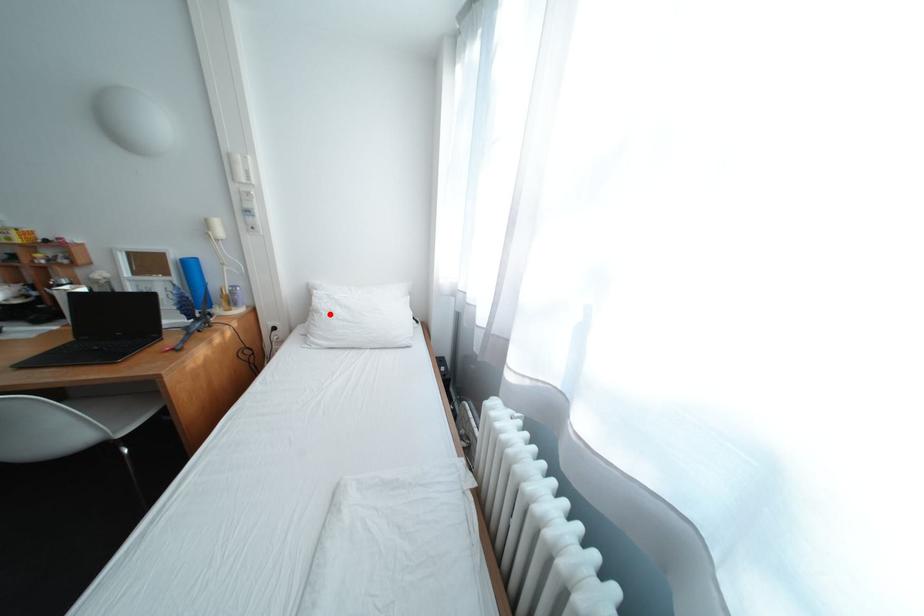
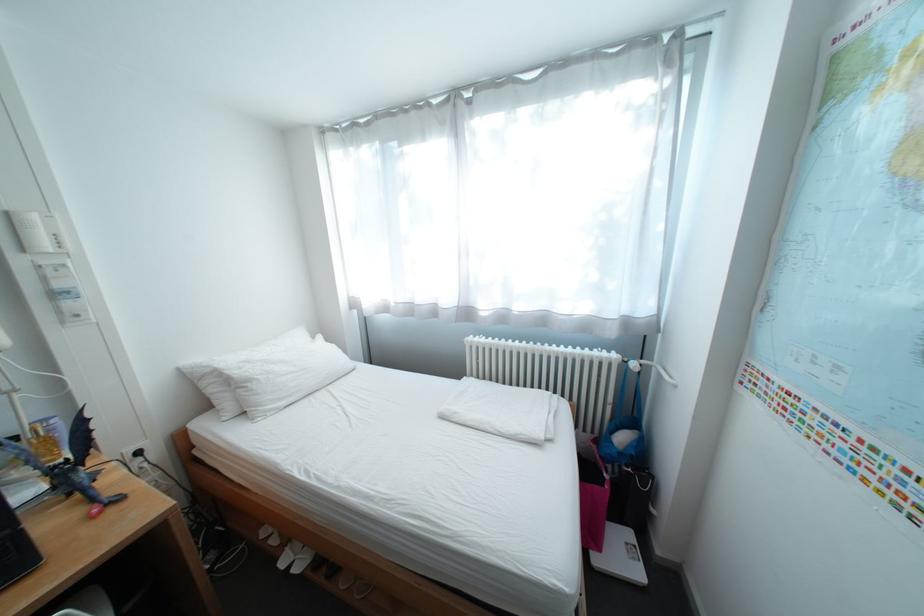
In the second image, find the point that corresponds to the highlighted location in the first image.

(263, 383)